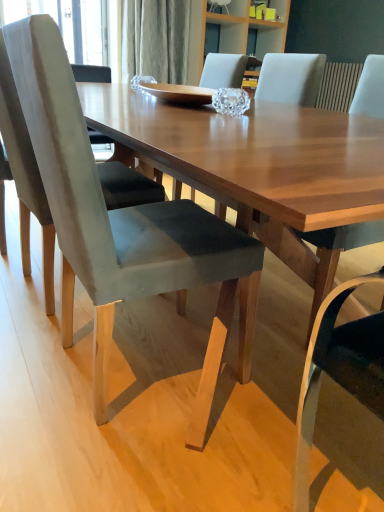
Question: From the image's perspective, is matte gray chair at center, which is the first chair in right-to-left order, above suede gray chair at left, positioned as the first chair in left-to-right order?

Choices:
 (A) yes
 (B) no

Answer: (B)

Question: Considering the relative sizes of matte gray chair at center, which is the first chair in right-to-left order, and suede gray chair at left, the 3th chair from the right, in the image provided, is matte gray chair at center, which is the first chair in right-to-left order, taller than suede gray chair at left, the 3th chair from the right,?

Choices:
 (A) yes
 (B) no

Answer: (B)

Question: From a real-world perspective, is matte gray chair at center, which is the first chair in right-to-left order, positioned over suede gray chair at left, the 3th chair from the right, based on gravity?

Choices:
 (A) no
 (B) yes

Answer: (A)

Question: Is matte gray chair at center, which is the first chair in right-to-left order, thinner than suede gray chair at left, positioned as the first chair in left-to-right order?

Choices:
 (A) yes
 (B) no

Answer: (A)

Question: Is matte gray chair at center, the third chair when ordered from left to right, wider than suede gray chair at left, positioned as the first chair in left-to-right order?

Choices:
 (A) no
 (B) yes

Answer: (A)

Question: Would you say velvet gray chair at center, positioned as the 2th chair in left-to-right order, is to the left or to the right of suede gray chair at left, positioned as the first chair in left-to-right order, in the picture?

Choices:
 (A) right
 (B) left

Answer: (A)

Question: Is point (64, 263) closer or farther from the camera than point (21, 182)?

Choices:
 (A) closer
 (B) farther

Answer: (A)

Question: Is velvet gray chair at center, marked as the 2th chair in a right-to-left arrangement, taller or shorter than suede gray chair at left, positioned as the first chair in left-to-right order?

Choices:
 (A) tall
 (B) short

Answer: (B)

Question: Is velvet gray chair at center, marked as the 2th chair in a right-to-left arrangement, in front of or behind suede gray chair at left, positioned as the first chair in left-to-right order, in the image?

Choices:
 (A) behind
 (B) front

Answer: (B)

Question: Choose the correct answer: Is velvet gray chair at center, marked as the 2th chair in a right-to-left arrangement, inside matte gray chair at center, which is the first chair in right-to-left order, or outside it?

Choices:
 (A) outside
 (B) inside

Answer: (A)

Question: Considering the positions of point [x=218, y=330] and point [x=362, y=86], is point [x=218, y=330] closer or farther from the camera than point [x=362, y=86]?

Choices:
 (A) closer
 (B) farther

Answer: (A)

Question: Is velvet gray chair at center, positioned as the 2th chair in left-to-right order, in front of or behind matte gray chair at center, the third chair when ordered from left to right, in the image?

Choices:
 (A) behind
 (B) front

Answer: (B)

Question: In terms of height, does velvet gray chair at center, marked as the 2th chair in a right-to-left arrangement, look taller or shorter compared to matte gray chair at center, which is the first chair in right-to-left order?

Choices:
 (A) short
 (B) tall

Answer: (B)

Question: Visually, is suede gray chair at left, positioned as the first chair in left-to-right order, positioned to the left or to the right of velvet gray chair at center, positioned as the 2th chair in left-to-right order?

Choices:
 (A) right
 (B) left

Answer: (B)

Question: Does point (23, 136) appear closer or farther from the camera than point (150, 284)?

Choices:
 (A) closer
 (B) farther

Answer: (B)